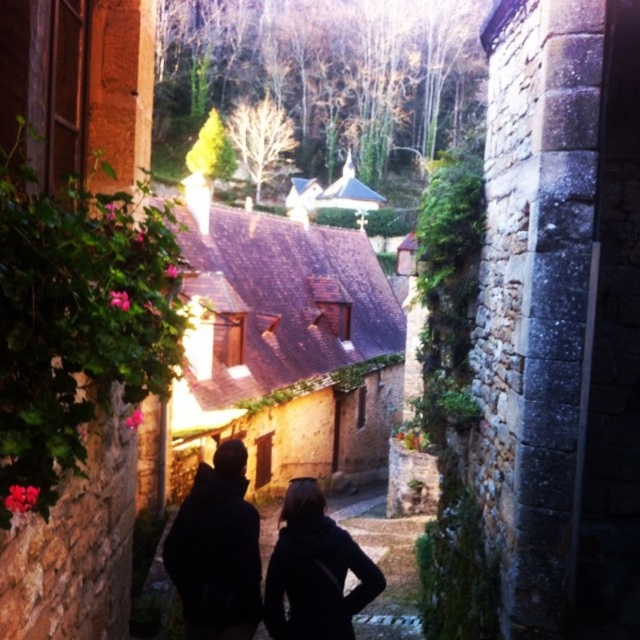
Looking at this image, you are standing at the point with coordinates (216, 550). Looking around, you see a black matte clothing at center. Is the black matte clothing at center in front of or behind your current position?

The black matte clothing at center is located at the point you are currently standing, so it is neither in front nor behind your position.

You are a photographer trying to capture the two people walking towards the stone building. Since you want to ensure both the black matte clothing at center and the black matte jacket at center are clearly visible in your shot, which one should you focus on first to account for their size difference?

The black matte clothing at center is larger in size than the black matte jacket at center, so you should focus on the black matte clothing at center first as it occupies more space in the frame.